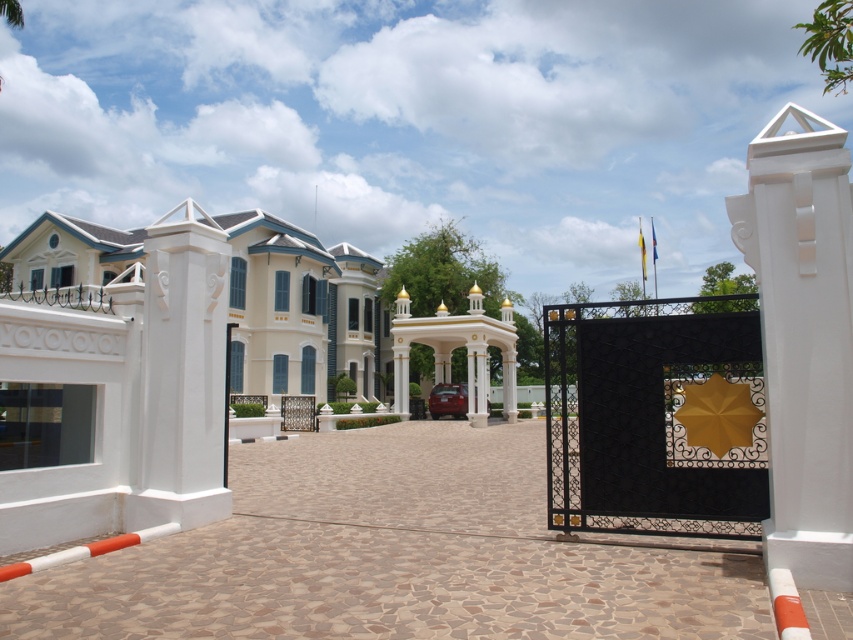
Does black wrought iron gate at center appear over white smooth column at center?

No, black wrought iron gate at center is not above white smooth column at center.

Describe the element at coordinates (657, 417) in the screenshot. This screenshot has width=853, height=640. I see `black wrought iron gate at center` at that location.

Is point (741, 435) positioned after point (194, 292)?

That is False.

You are a GUI agent. You are given a task and a screenshot of the screen. Output one action in this format:
    pyautogui.click(x=<x>, y=<y>)
    Task: Click on the black wrought iron gate at center
    Image resolution: width=853 pixels, height=640 pixels.
    Given the screenshot: What is the action you would take?
    pyautogui.click(x=657, y=417)

In the scene shown: Which is more to the left, brown mosaic driveway at center or white smooth pillar at right?

From the viewer's perspective, brown mosaic driveway at center appears more on the left side.

Which is above, brown mosaic driveway at center or white smooth pillar at right?

white smooth pillar at right

Which is behind, point (750, 625) or point (769, 243)?

The point (769, 243) is behind.

Find the location of `brown mosaic driveway at center`. brown mosaic driveway at center is located at coordinates (393, 556).

From the picture: Is white glossy building at center shorter than white smooth column at center?

No, white glossy building at center is not shorter than white smooth column at center.

Between white glossy building at center and white smooth column at center, which one has more height?

With more height is white glossy building at center.

Describe the element at coordinates (299, 308) in the screenshot. I see `white glossy building at center` at that location.

You are a GUI agent. You are given a task and a screenshot of the screen. Output one action in this format:
    pyautogui.click(x=<x>, y=<y>)
    Task: Click on the white glossy building at center
    The height and width of the screenshot is (640, 853).
    Given the screenshot: What is the action you would take?
    pyautogui.click(x=299, y=308)